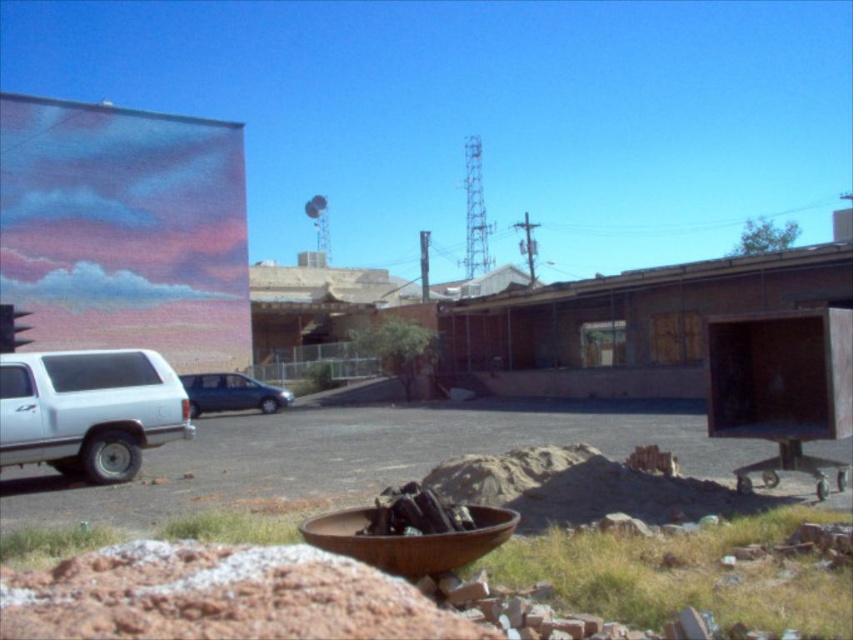
Question: Which of the following is the closest to the observer?

Choices:
 (A) white matte truck at left
 (B) satin blue sedan at center

Answer: (A)

Question: Which point is closer to the camera?

Choices:
 (A) (70, 429)
 (B) (192, 372)

Answer: (A)

Question: Among these objects, which one is nearest to the camera?

Choices:
 (A) white matte truck at left
 (B) satin blue sedan at center

Answer: (A)

Question: Does white matte truck at left lie in front of satin blue sedan at center?

Choices:
 (A) no
 (B) yes

Answer: (B)

Question: Is white matte truck at left further to the viewer compared to satin blue sedan at center?

Choices:
 (A) no
 (B) yes

Answer: (A)

Question: Can you confirm if white matte truck at left is positioned to the left of satin blue sedan at center?

Choices:
 (A) no
 (B) yes

Answer: (B)